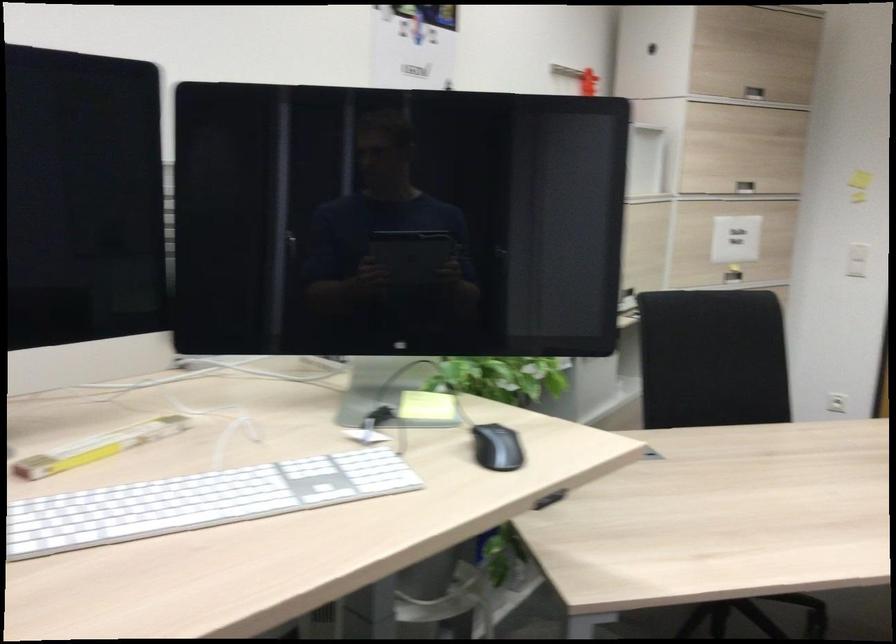
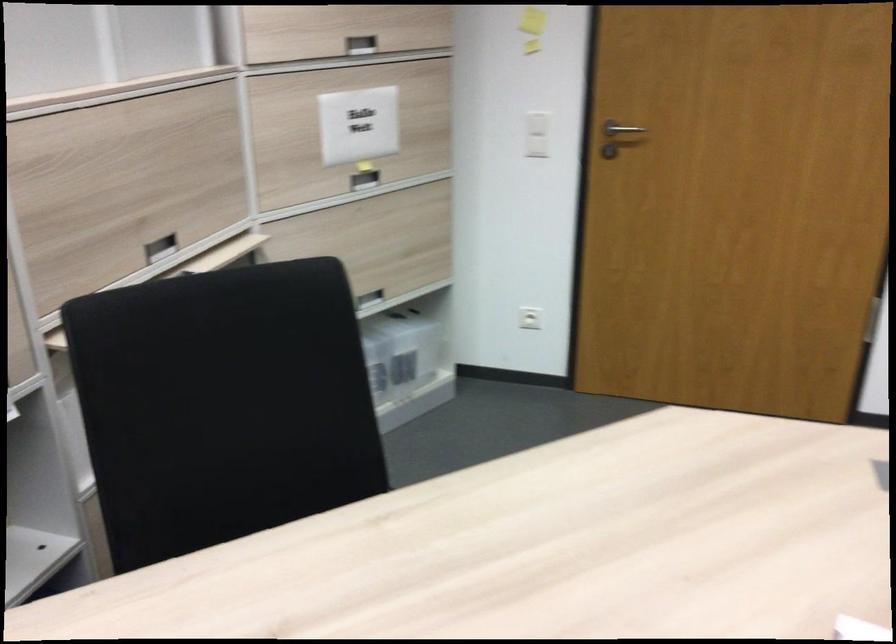
The point at [745,238] is marked in the first image. Where is the corresponding point in the second image?

(358, 125)